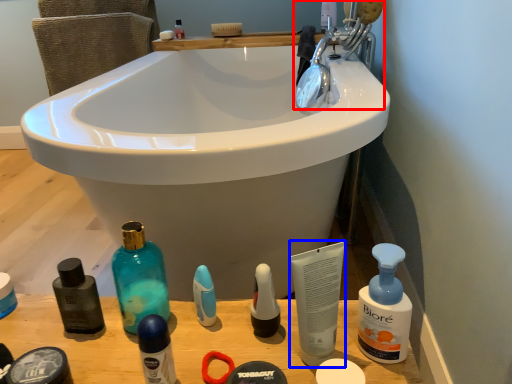
Question: Which object appears closest to the camera in this image, tap (highlighted by a red box) or toiletry (highlighted by a blue box)?

Choices:
 (A) tap
 (B) toiletry

Answer: (B)